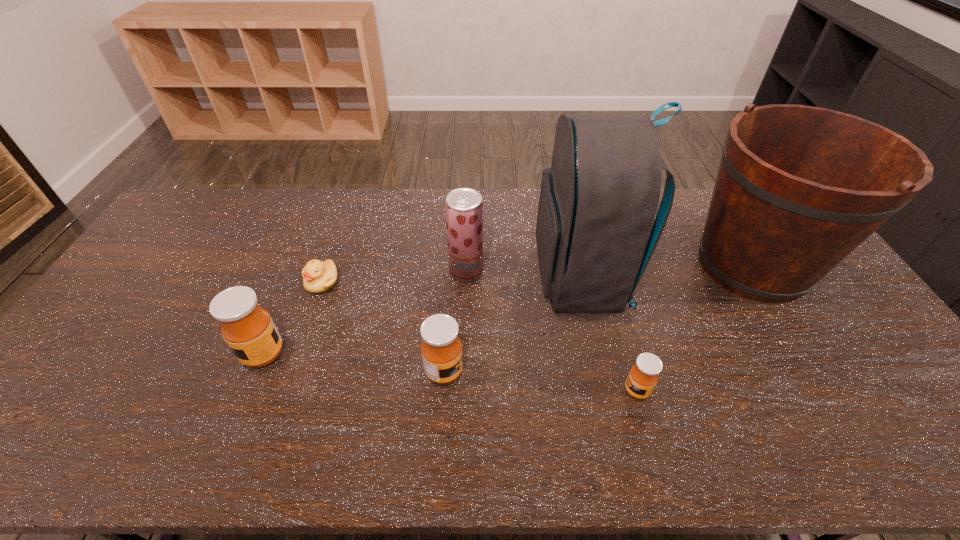
Locate an element on the screen. This screenshot has height=540, width=960. the leftmost honey is located at coordinates (248, 329).

Locate an element on the screen. the second honey from left to right is located at coordinates (441, 348).

Where is `the fifth tallest object`? This screenshot has width=960, height=540. the fifth tallest object is located at coordinates pyautogui.click(x=441, y=348).

You are a GUI agent. You are given a task and a screenshot of the screen. Output one action in this format:
    pyautogui.click(x=<x>, y=<y>)
    Task: Click on the rightmost honey
    Image resolution: width=960 pixels, height=540 pixels.
    Given the screenshot: What is the action you would take?
    pyautogui.click(x=643, y=376)

Locate an element on the screen. the shortest honey is located at coordinates (643, 376).

Find the location of a particular element. Image resolution: width=960 pixels, height=540 pixels. the second tallest object is located at coordinates (799, 187).

At what (x,y) coordinates should I click in order to perform the action: click on the rightmost object. Please return your answer as a coordinate pair (x, y). This screenshot has width=960, height=540. Looking at the image, I should click on (799, 187).

Where is `the shortest object`? The image size is (960, 540). the shortest object is located at coordinates (318, 276).

Where is `the tallest object`? This screenshot has height=540, width=960. the tallest object is located at coordinates (598, 201).

The width and height of the screenshot is (960, 540). In order to click on the fifth shortest object in this screenshot , I will do `click(464, 207)`.